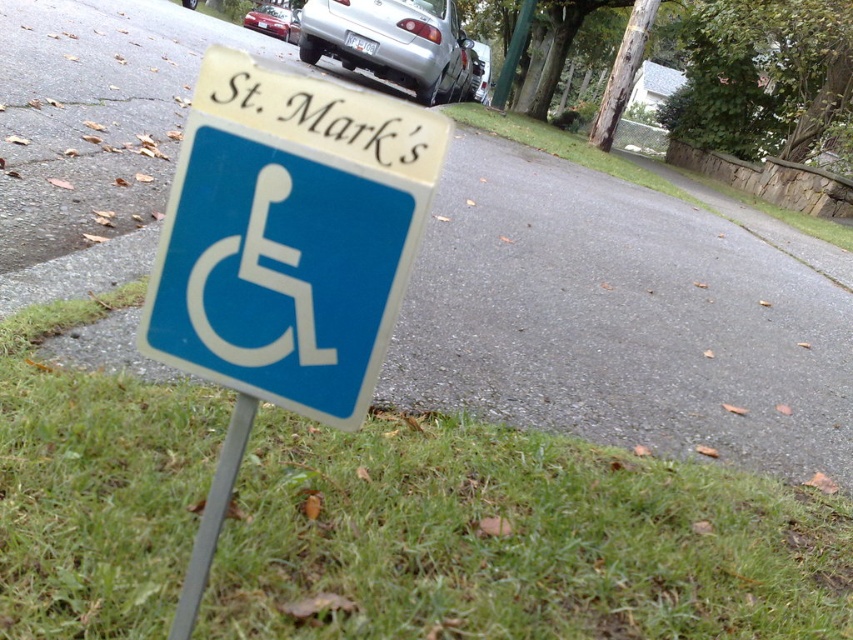
Which is above, green grass at lower left or silver metallic car at upper center?

silver metallic car at upper center is above.

The width and height of the screenshot is (853, 640). Find the location of `green grass at lower left`. green grass at lower left is located at coordinates (514, 540).

Is point (520, 605) closer to camera compared to point (259, 4)?

Yes, point (520, 605) is closer to viewer.

Measure the distance between point (263, 464) and camera.

A distance of 1.11 meters exists between point (263, 464) and camera.

At what (x,y) coordinates should I click in order to perform the action: click on green grass at lower left. Please return your answer as a coordinate pair (x, y). Looking at the image, I should click on (514, 540).

Which is in front, point (132, 540) or point (474, 83)?

Positioned in front is point (132, 540).

Between green grass at lower left and silver metallic car at center, which one appears on the left side from the viewer's perspective?

From the viewer's perspective, green grass at lower left appears more on the left side.

The height and width of the screenshot is (640, 853). Find the location of `green grass at lower left`. green grass at lower left is located at coordinates (514, 540).